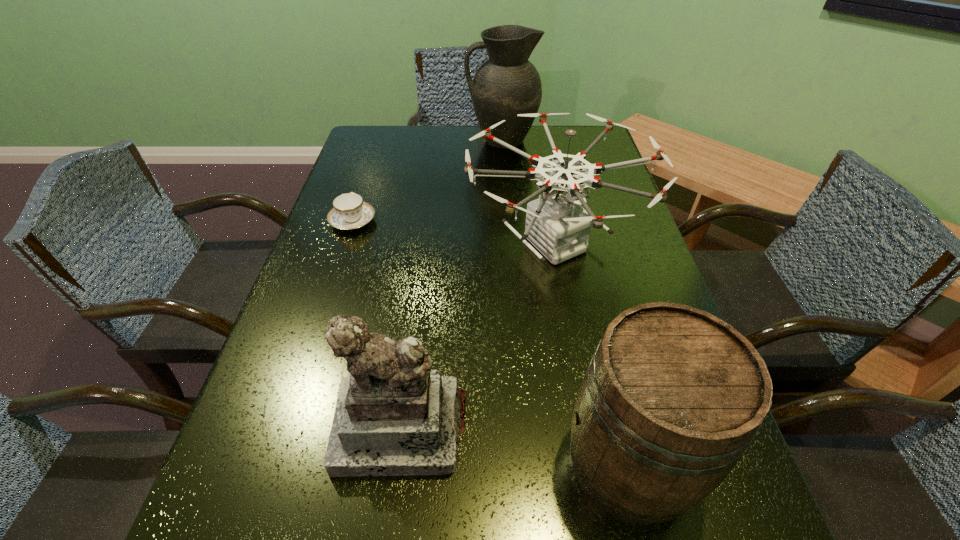
Locate an element on the screen. the farthest object is located at coordinates (506, 84).

I want to click on drone, so click(557, 225).

This screenshot has height=540, width=960. What are the coordinates of `figurine` in the screenshot? It's located at (394, 416).

At what (x,y) coordinates should I click in order to perform the action: click on cider. Please return your answer as a coordinate pair (x, y). The width and height of the screenshot is (960, 540). Looking at the image, I should click on (672, 397).

You are a GUI agent. You are given a task and a screenshot of the screen. Output one action in this format:
    pyautogui.click(x=<x>, y=<y>)
    Task: Click on the leftmost object
    
    Given the screenshot: What is the action you would take?
    pyautogui.click(x=349, y=212)

I want to click on teacup, so click(x=349, y=212).

What are the coordinates of `vacant space situated 0.050m on the side of the farthest object with the handle` in the screenshot? It's located at (450, 141).

The image size is (960, 540). I want to click on free spot located 0.230m on the side of the farthest object with the handle, so click(x=394, y=141).

The width and height of the screenshot is (960, 540). In order to click on free space located 0.350m on the side of the farthest object with the handle in this screenshot , I will do `click(356, 141)`.

Where is `free point located 0.170m on the back of the drone`? The height and width of the screenshot is (540, 960). free point located 0.170m on the back of the drone is located at coordinates (540, 161).